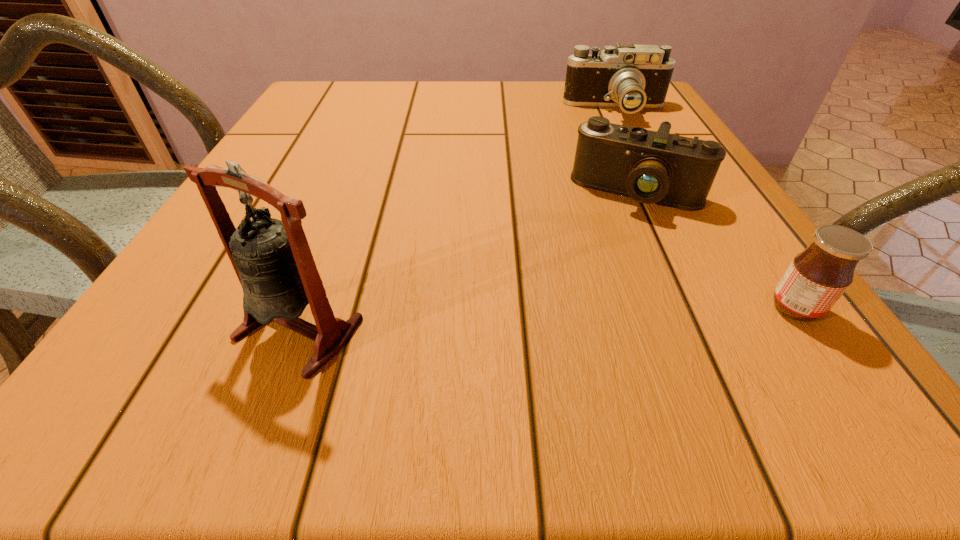
Where is `vacant area that lies between the tallest object and the jam`? Image resolution: width=960 pixels, height=540 pixels. vacant area that lies between the tallest object and the jam is located at coordinates (547, 319).

The height and width of the screenshot is (540, 960). I want to click on free space between the jam and the nearer camera, so click(x=716, y=251).

The width and height of the screenshot is (960, 540). Identify the location of empty space between the tallest object and the jam. (547, 319).

You are a GUI agent. You are given a task and a screenshot of the screen. Output one action in this format:
    pyautogui.click(x=<x>, y=<y>)
    Task: Click on the free spot between the jam and the farthest object
    This screenshot has height=540, width=960.
    Given the screenshot: What is the action you would take?
    pyautogui.click(x=706, y=210)

The height and width of the screenshot is (540, 960). In order to click on free spot between the nearer camera and the leftmost object in this screenshot , I will do `click(468, 261)`.

You are a GUI agent. You are given a task and a screenshot of the screen. Output one action in this format:
    pyautogui.click(x=<x>, y=<y>)
    Task: Click on the vacant region between the jam and the leftmost object
    The width and height of the screenshot is (960, 540).
    Given the screenshot: What is the action you would take?
    pyautogui.click(x=547, y=319)

At what (x,y) coordinates should I click in order to perform the action: click on object identified as the second closest to the jam. Please return your answer as a coordinate pair (x, y). This screenshot has height=540, width=960. Looking at the image, I should click on (633, 77).

This screenshot has height=540, width=960. What are the coordinates of `object that ranks as the closest to the nearer camera` in the screenshot? It's located at (817, 277).

Locate an element on the screen. Image resolution: width=960 pixels, height=540 pixels. vacant region that satisfies the following two spatial constraints: 1. on the front side of the nearer camera; 2. on the label side of the jam is located at coordinates (689, 308).

Identify the location of free spot that satisfies the following two spatial constraints: 1. on the front side of the farther camera; 2. on the label side of the jam. The width and height of the screenshot is (960, 540). (720, 308).